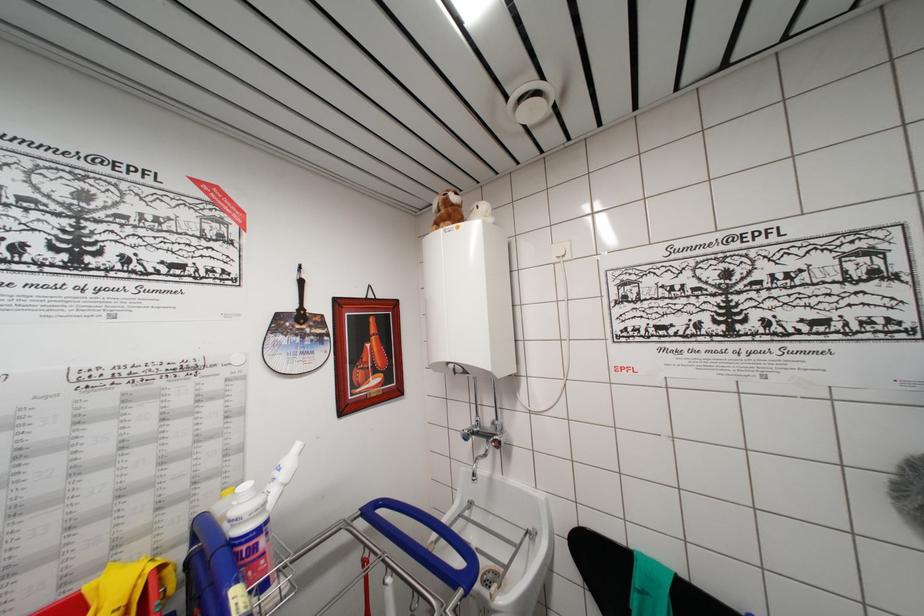
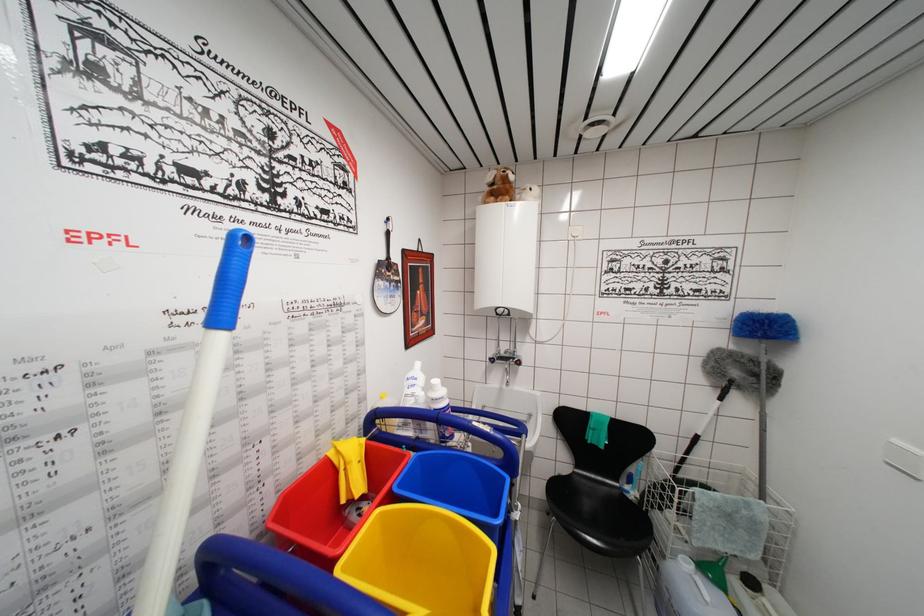
Question: Based on the continuous images, in which direction is the camera rotating? Reply with the corresponding letter.

Choices:
 (A) Left
 (B) Right
 (C) Up
 (D) Down

Answer: (B)